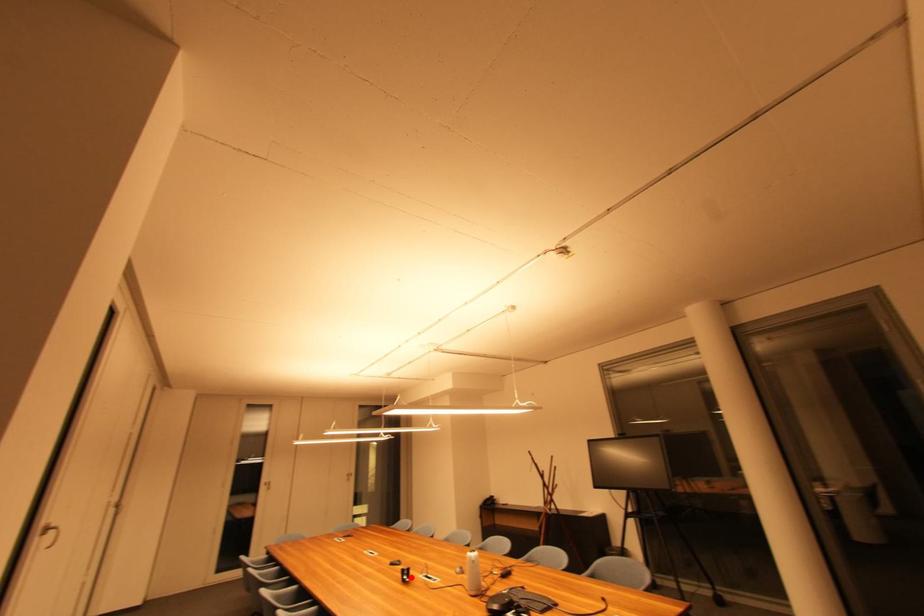
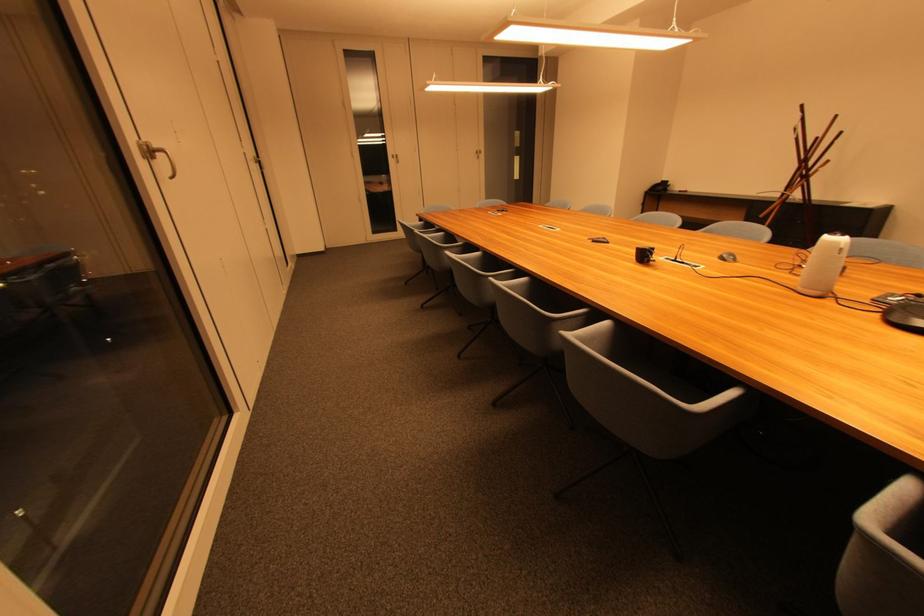
Locate, in the second image, the point that corresponds to the highlighted location in the first image.

(649, 257)